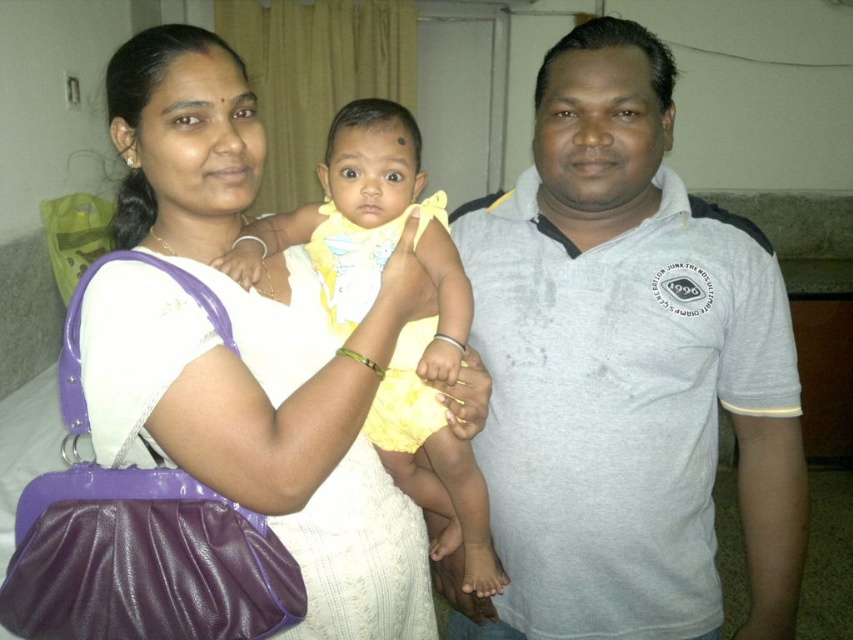
Find the location of a particular element. The width and height of the screenshot is (853, 640). gray cotton shirt at center is located at coordinates (625, 371).

Does gray cotton shirt at center appear on the right side of yellow fabric cloth at center?

Yes, gray cotton shirt at center is to the right of yellow fabric cloth at center.

Which is behind, point (585, 280) or point (427, 506)?

Point (427, 506)

Locate an element on the screen. The image size is (853, 640). gray cotton shirt at center is located at coordinates (625, 371).

Who is positioned more to the right, gray cotton shirt at center or matte white dress at center?

gray cotton shirt at center is more to the right.

Based on the photo, measure the distance from gray cotton shirt at center to matte white dress at center.

The distance of gray cotton shirt at center from matte white dress at center is 11.57 inches.

Does point (611, 81) come farther from viewer compared to point (332, 385)?

Yes, it is.

The width and height of the screenshot is (853, 640). In order to click on gray cotton shirt at center in this screenshot , I will do `click(625, 371)`.

Which is below, matte white dress at center or yellow fabric cloth at center?

matte white dress at center is lower down.

Is matte white dress at center positioned behind yellow fabric cloth at center?

No, it is in front of yellow fabric cloth at center.

What do you see at coordinates (247, 346) in the screenshot? Image resolution: width=853 pixels, height=640 pixels. I see `matte white dress at center` at bounding box center [247, 346].

Locate an element on the screen. The image size is (853, 640). matte white dress at center is located at coordinates (247, 346).